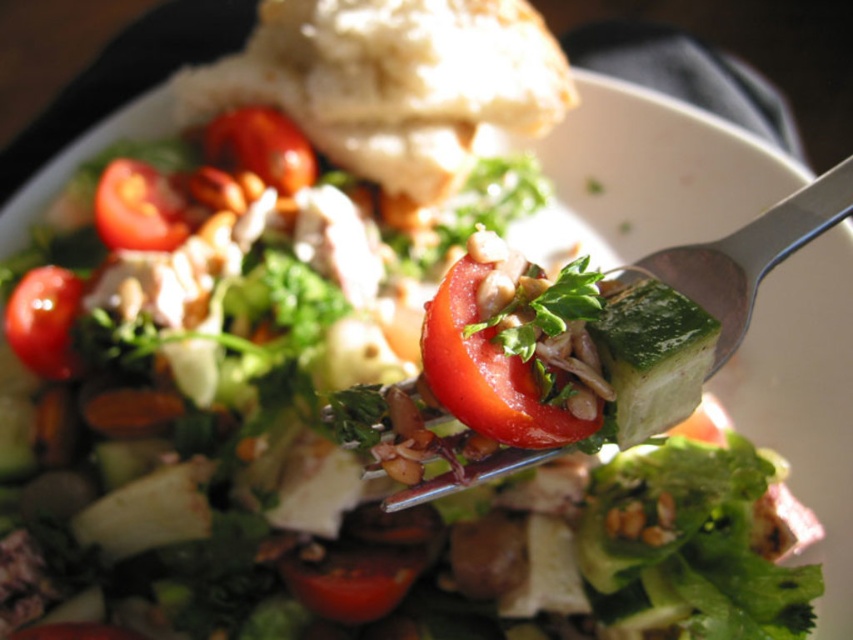
Question: Can you confirm if red juicy tomato at center is bigger than glossy red tomato at lower left?

Choices:
 (A) no
 (B) yes

Answer: (A)

Question: Based on their relative distances, which object is nearer to the glossy red tomato at center?

Choices:
 (A) red juicy tomato at center
 (B) shiny red tomato at upper left

Answer: (B)

Question: Among these points, which one is farthest from the camera?

Choices:
 (A) (137, 234)
 (B) (20, 358)

Answer: (A)

Question: Where is glossy red tomato at center located in relation to shiny red tomato at upper left in the image?

Choices:
 (A) left
 (B) right

Answer: (B)

Question: Based on their relative distances, which object is farther from the shiny red tomato at upper left?

Choices:
 (A) glossy red tomato at lower left
 (B) red juicy tomato at center

Answer: (B)

Question: Is glossy red tomato at lower left wider than glossy red tomato at center?

Choices:
 (A) yes
 (B) no

Answer: (B)